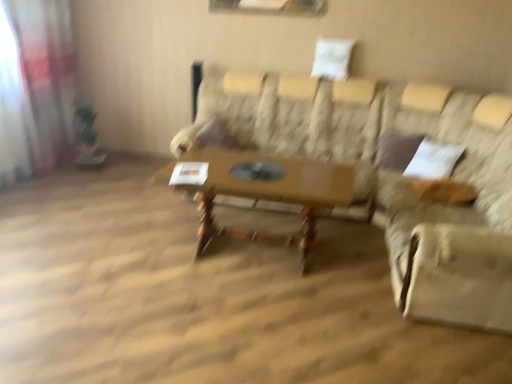
Describe the element at coordinates (395, 177) in the screenshot. The height and width of the screenshot is (384, 512). I see `patterned fabric couch at center` at that location.

In order to click on beige fabric swivel chair at right in this screenshot , I will do `click(452, 211)`.

Describe the element at coordinates (452, 211) in the screenshot. This screenshot has width=512, height=384. I see `beige fabric swivel chair at right` at that location.

Describe the element at coordinates (45, 78) in the screenshot. I see `translucent fabric curtain at left` at that location.

Where is `patterned fabric couch at center`? The height and width of the screenshot is (384, 512). patterned fabric couch at center is located at coordinates (395, 177).

Looking at the image, does patterned fabric couch at center seem bigger or smaller compared to wooden table at center?

patterned fabric couch at center is bigger than wooden table at center.

In the scene shown: Is there a large distance between patterned fabric couch at center and wooden table at center?

patterned fabric couch at center is near wooden table at center, not far away.

Does patterned fabric couch at center have a lesser height compared to wooden table at center?

No.

Does patterned fabric couch at center appear on the left side of wooden table at center?

In fact, patterned fabric couch at center is to the right of wooden table at center.

Which object is positioned more to the right, wooden table at center or translucent fabric curtain at left?

Positioned to the right is wooden table at center.

From a real-world perspective, is wooden table at center physically below translucent fabric curtain at left?

Correct, in the physical world, wooden table at center is lower than translucent fabric curtain at left.

Considering the relative sizes of wooden table at center and translucent fabric curtain at left in the image provided, is wooden table at center thinner than translucent fabric curtain at left?

In fact, wooden table at center might be wider than translucent fabric curtain at left.

Is wooden table at center taller than patterned fabric couch at center?

Incorrect, the height of wooden table at center is not larger of that of patterned fabric couch at center.

Is wooden table at center aimed at patterned fabric couch at center?

Yes, wooden table at center is oriented towards patterned fabric couch at center.

What are the coordinates of `table on the left of patterned fabric couch at center` in the screenshot? It's located at (261, 190).

Is wooden table at center located outside patterned fabric couch at center?

No, wooden table at center is inside or overlapping with patterned fabric couch at center.

Considering the positions of objects beige fabric swivel chair at right and patterned fabric couch at center in the image provided, who is more to the right, beige fabric swivel chair at right or patterned fabric couch at center?

From the viewer's perspective, beige fabric swivel chair at right appears more on the right side.

Is patterned fabric couch at center at the back of beige fabric swivel chair at right?

Yes.

Is beige fabric swivel chair at right next to patterned fabric couch at center and touching it?

No, beige fabric swivel chair at right is not next to patterned fabric couch at center.

From the picture: From the image's perspective, relative to patterned fabric couch at center, is beige fabric swivel chair at right above or below?

Based on their image positions, beige fabric swivel chair at right is located beneath patterned fabric couch at center.

Does beige fabric swivel chair at right have a lesser width compared to translucent fabric curtain at left?

In fact, beige fabric swivel chair at right might be wider than translucent fabric curtain at left.

Is beige fabric swivel chair at right looking in the opposite direction of translucent fabric curtain at left?

beige fabric swivel chair at right is not turned away from translucent fabric curtain at left.

Consider the image. Considering the relative sizes of beige fabric swivel chair at right and translucent fabric curtain at left in the image provided, is beige fabric swivel chair at right bigger than translucent fabric curtain at left?

Yes, beige fabric swivel chair at right is bigger than translucent fabric curtain at left.

From the image's perspective, is patterned fabric couch at center above beige fabric swivel chair at right?

Yes, from the image's perspective, patterned fabric couch at center is above beige fabric swivel chair at right.

Which is in front, point (496, 145) or point (397, 183)?

Positioned in front is point (496, 145).

Which is behind, patterned fabric couch at center or beige fabric swivel chair at right?

beige fabric swivel chair at right is further away from the camera.

Is translucent fabric curtain at left closer to the viewer compared to wooden table at center?

No, it is not.

Considering the positions of point (36, 153) and point (351, 195), is point (36, 153) closer or farther from the camera than point (351, 195)?

Point (36, 153) is positioned farther from the camera compared to point (351, 195).

How far apart are translucent fabric curtain at left and wooden table at center?

translucent fabric curtain at left and wooden table at center are 7.67 feet apart from each other.

In the scene shown: Considering the relative positions of translucent fabric curtain at left and wooden table at center in the image provided, is translucent fabric curtain at left to the left or to the right of wooden table at center?

translucent fabric curtain at left is to the left of wooden table at center.

Where is `table that is on the left side of patterned fabric couch at center`? table that is on the left side of patterned fabric couch at center is located at coordinates click(x=261, y=190).

In the image, there is a wooden table at center. In order to click on curtain above it (from the image's perspective) in this screenshot , I will do `click(45, 78)`.

Looking at the image, which one is located further to beige fabric swivel chair at right, translucent fabric curtain at left or patterned fabric couch at center?

The object further to beige fabric swivel chair at right is translucent fabric curtain at left.

When comparing their distances from translucent fabric curtain at left, does beige fabric swivel chair at right or patterned fabric couch at center seem further?

beige fabric swivel chair at right is further to translucent fabric curtain at left.

Based on the photo, from the image, which object appears to be nearer to beige fabric swivel chair at right, patterned fabric couch at center or wooden table at center?

patterned fabric couch at center is positioned closer to the anchor beige fabric swivel chair at right.

Looking at this image, which object lies further to the anchor point beige fabric swivel chair at right, patterned fabric couch at center or translucent fabric curtain at left?

translucent fabric curtain at left lies further to beige fabric swivel chair at right than the other object.

When comparing their distances from patterned fabric couch at center, does translucent fabric curtain at left or wooden table at center seem closer?

Among the two, wooden table at center is located nearer to patterned fabric couch at center.

When comparing their distances from translucent fabric curtain at left, does patterned fabric couch at center or beige fabric swivel chair at right seem closer?

patterned fabric couch at center.

Looking at the image, which one is located further to beige fabric swivel chair at right, wooden table at center or patterned fabric couch at center?

wooden table at center is positioned further to the anchor beige fabric swivel chair at right.

Considering their positions, is beige fabric swivel chair at right positioned closer to translucent fabric curtain at left than wooden table at center?

The object closer to translucent fabric curtain at left is wooden table at center.

The height and width of the screenshot is (384, 512). What are the coordinates of `studio couch located between wooden table at center and beige fabric swivel chair at right in the left-right direction` in the screenshot? It's located at (395, 177).

I want to click on table situated between translucent fabric curtain at left and patterned fabric couch at center from left to right, so click(261, 190).

What are the coordinates of `studio couch located between translucent fabric curtain at left and beige fabric swivel chair at right in the left-right direction` in the screenshot? It's located at (395, 177).

I want to click on table between translucent fabric curtain at left and beige fabric swivel chair at right, so click(x=261, y=190).